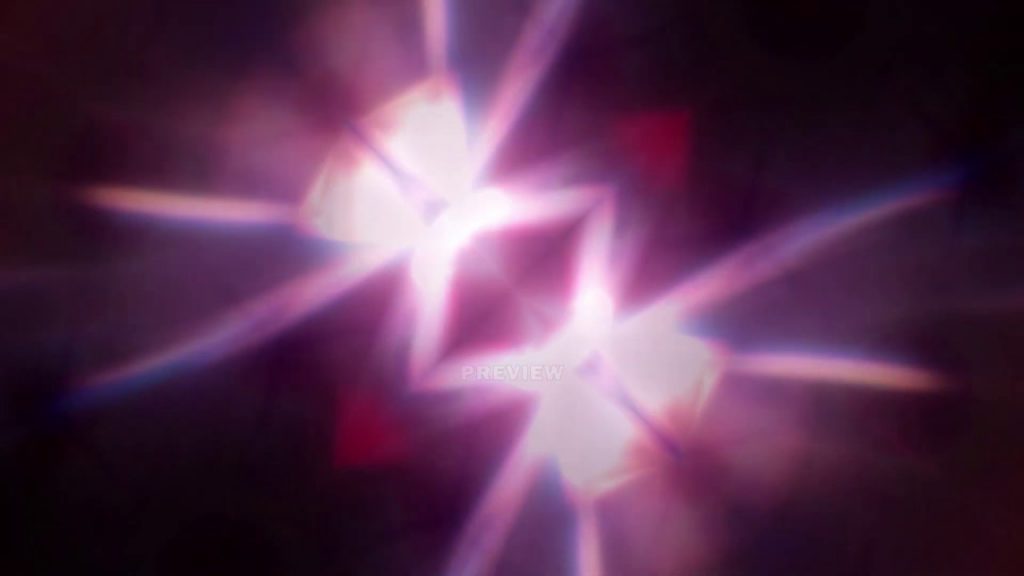
Find the location of a particular element. Image resolution: width=1024 pixels, height=576 pixels. light purple triangular light shapes is located at coordinates (382, 206), (445, 161), (607, 425), (649, 371).